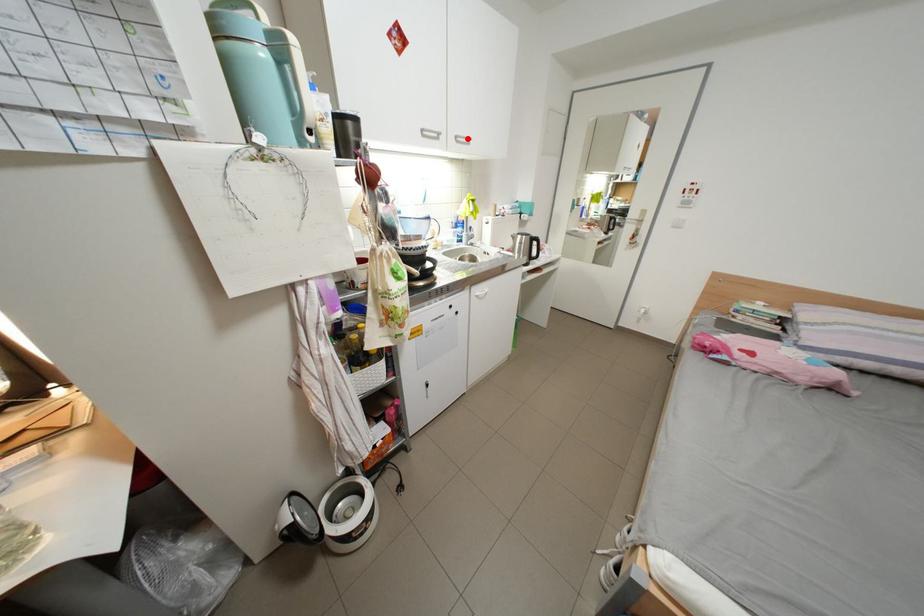
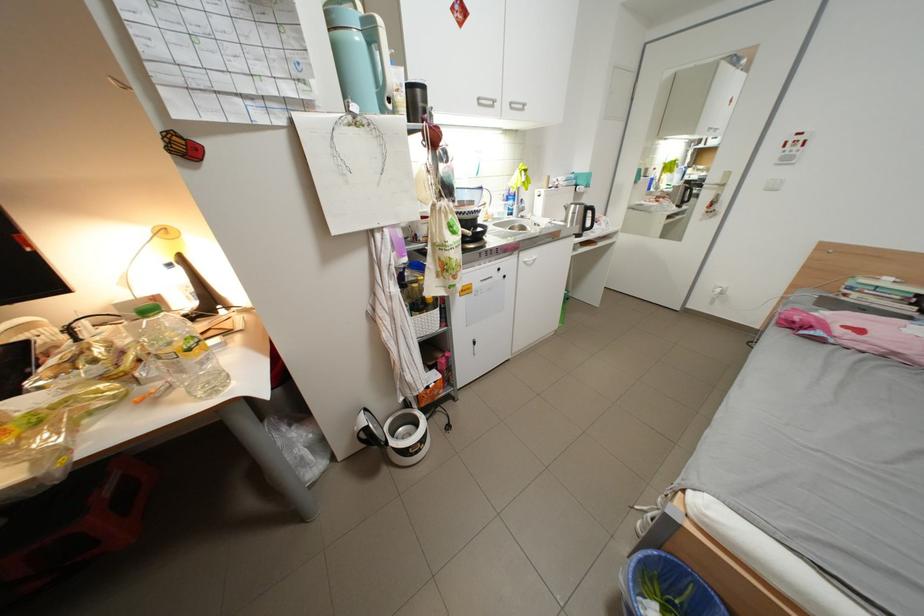
Question: I am providing you with two images of the same scene from different viewpoints. A red point is marked on the first image. At the location where the point appears in image 1, is it still visible in image 2?

Choices:
 (A) Yes
 (B) No

Answer: (A)